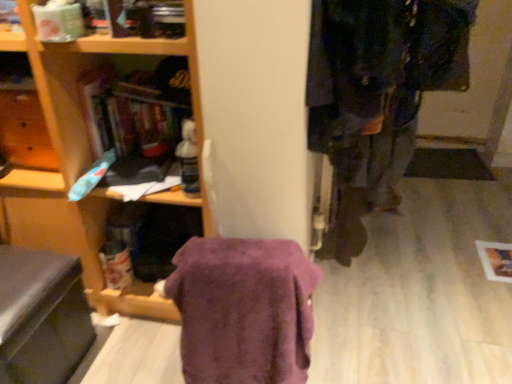
Where is `purple fuzzy blanket at center`? The height and width of the screenshot is (384, 512). purple fuzzy blanket at center is located at coordinates (243, 310).

From the image's perspective, is black leather swivel chair at lower left above or below purple fuzzy blanket at center?

Based on their image positions, black leather swivel chair at lower left is located beneath purple fuzzy blanket at center.

Based on the photo, does black leather swivel chair at lower left have a smaller size compared to purple fuzzy blanket at center?

No, black leather swivel chair at lower left is not smaller than purple fuzzy blanket at center.

Looking at this image, is black leather swivel chair at lower left spatially inside purple fuzzy blanket at center, or outside of it?

The correct answer is: outside.

Is dark blue fabric coat at right not near black leather swivel chair at lower left?

Absolutely, dark blue fabric coat at right is distant from black leather swivel chair at lower left.

Consider the image. Considering the relative sizes of dark blue fabric coat at right and black leather swivel chair at lower left in the image provided, is dark blue fabric coat at right wider than black leather swivel chair at lower left?

Yes.

How many degrees apart are the facing directions of dark blue fabric coat at right and black leather swivel chair at lower left?

dark blue fabric coat at right and black leather swivel chair at lower left are facing 0.126 degrees away from each other.

Does purple fuzzy blanket at center have a smaller size compared to dark blue fabric coat at right?

Yes.

Between purple fuzzy blanket at center and dark blue fabric coat at right, which one has less height?

Standing shorter between the two is dark blue fabric coat at right.

Consider the image. Are purple fuzzy blanket at center and dark blue fabric coat at right making contact?

No, purple fuzzy blanket at center is not beside dark blue fabric coat at right.

Is black leather swivel chair at lower left shorter than dark blue fabric coat at right?

Incorrect, the height of black leather swivel chair at lower left does not fall short of that of dark blue fabric coat at right.

Based on the photo, from the image's perspective, which one is positioned higher, black leather swivel chair at lower left or dark blue fabric coat at right?

dark blue fabric coat at right.

Does black leather swivel chair at lower left have a lesser width compared to dark blue fabric coat at right?

Yes, black leather swivel chair at lower left is thinner than dark blue fabric coat at right.

You are a GUI agent. You are given a task and a screenshot of the screen. Output one action in this format:
    pyautogui.click(x=<x>, y=<y>)
    Task: Click on the swivel chair located behind the purple fuzzy blanket at center
    The width and height of the screenshot is (512, 384).
    Given the screenshot: What is the action you would take?
    pyautogui.click(x=41, y=317)

Can you confirm if purple fuzzy blanket at center is taller than black leather swivel chair at lower left?

Yes, purple fuzzy blanket at center is taller than black leather swivel chair at lower left.

Is purple fuzzy blanket at center far away from black leather swivel chair at lower left?

purple fuzzy blanket at center is near black leather swivel chair at lower left, not far away.

Considering the positions of objects dark blue fabric coat at right and purple fuzzy blanket at center in the image provided, who is more to the right, dark blue fabric coat at right or purple fuzzy blanket at center?

From the viewer's perspective, dark blue fabric coat at right appears more on the right side.

In the image, there is a dark blue fabric coat at right. Where is `blanket below it (from a real-world perspective)`? The image size is (512, 384). blanket below it (from a real-world perspective) is located at coordinates (243, 310).

Can you tell me how much dark blue fabric coat at right and purple fuzzy blanket at center differ in facing direction?

The angle between the facing direction of dark blue fabric coat at right and the facing direction of purple fuzzy blanket at center is 85.7 degrees.

The width and height of the screenshot is (512, 384). What are the coordinates of `swivel chair directly beneath the purple fuzzy blanket at center (from a real-world perspective)` in the screenshot? It's located at (41, 317).

What are the coordinates of `swivel chair lying on the left of dark blue fabric coat at right` in the screenshot? It's located at (41, 317).

In the scene shown: Considering their positions, is dark blue fabric coat at right positioned further to black leather swivel chair at lower left than purple fuzzy blanket at center?

Based on the image, dark blue fabric coat at right appears to be further to black leather swivel chair at lower left.

Based on the photo, from the image, which object appears to be farther from dark blue fabric coat at right, purple fuzzy blanket at center or black leather swivel chair at lower left?

Among the two, black leather swivel chair at lower left is located further to dark blue fabric coat at right.

Estimate the real-world distances between objects in this image. Which object is closer to dark blue fabric coat at right, black leather swivel chair at lower left or purple fuzzy blanket at center?

purple fuzzy blanket at center lies closer to dark blue fabric coat at right than the other object.

Looking at this image, considering their positions, is purple fuzzy blanket at center positioned further to black leather swivel chair at lower left than dark blue fabric coat at right?

Among the two, dark blue fabric coat at right is located further to black leather swivel chair at lower left.

Estimate the real-world distances between objects in this image. Which object is further from purple fuzzy blanket at center, dark blue fabric coat at right or black leather swivel chair at lower left?

black leather swivel chair at lower left lies further to purple fuzzy blanket at center than the other object.

Looking at the image, which one is located closer to purple fuzzy blanket at center, black leather swivel chair at lower left or dark blue fabric coat at right?

The object closer to purple fuzzy blanket at center is dark blue fabric coat at right.

Locate an element on the screen. blanket situated between black leather swivel chair at lower left and dark blue fabric coat at right from left to right is located at coordinates (243, 310).